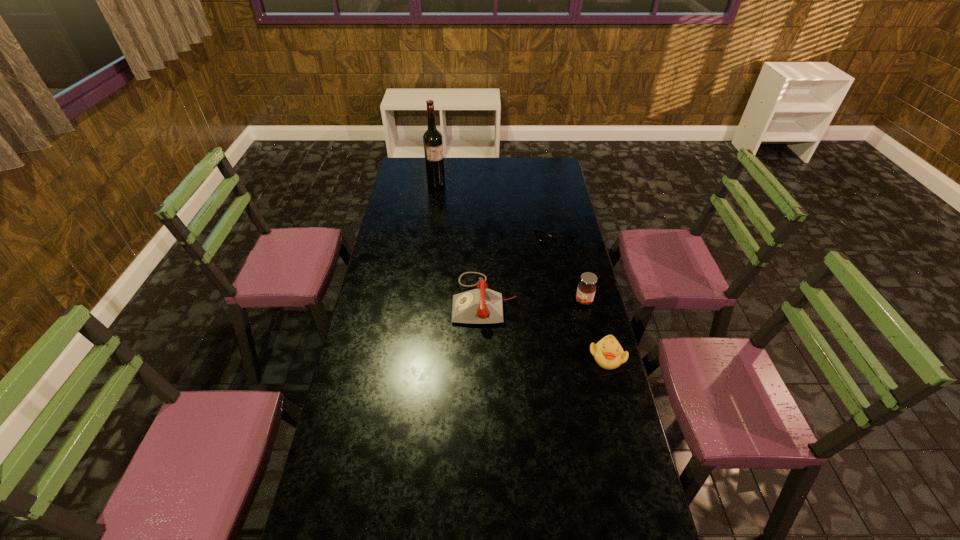
Where is `free spot between the leftmost object and the spectacles`? This screenshot has height=540, width=960. free spot between the leftmost object and the spectacles is located at coordinates (495, 211).

Choose which object is the third nearest neighbor to the spectacles. Please provide its 2D coordinates. Your answer should be formatted as a tuple, i.e. [(x, y)], where the tuple contains the x and y coordinates of a point satisfying the conditions above.

[(608, 353)]

What are the coordinates of `object that is the third closest to the duckling` in the screenshot? It's located at (541, 236).

The image size is (960, 540). What are the coordinates of `vacant area that satisfies the following two spatial constraints: 1. on the front side of the spectacles; 2. on the right side of the farthest object` in the screenshot? It's located at (429, 238).

The height and width of the screenshot is (540, 960). I want to click on free point that satisfies the following two spatial constraints: 1. on the front side of the farthest object; 2. on the right side of the jam, so click(420, 301).